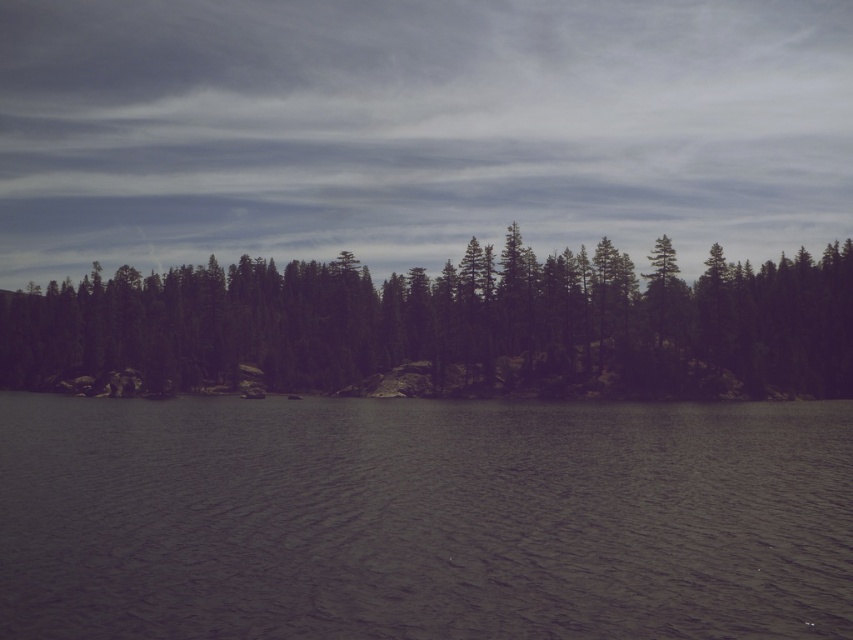
Between dark gray water at center and green matte trees at center, which one appears on the right side from the viewer's perspective?

dark gray water at center is more to the right.

Describe the element at coordinates (422, 518) in the screenshot. I see `dark gray water at center` at that location.

Is point (27, 593) farther from camera compared to point (808, 392)?

That is False.

At what (x,y) coordinates should I click in order to perform the action: click on dark gray water at center. Please return your answer as a coordinate pair (x, y). Looking at the image, I should click on (422, 518).